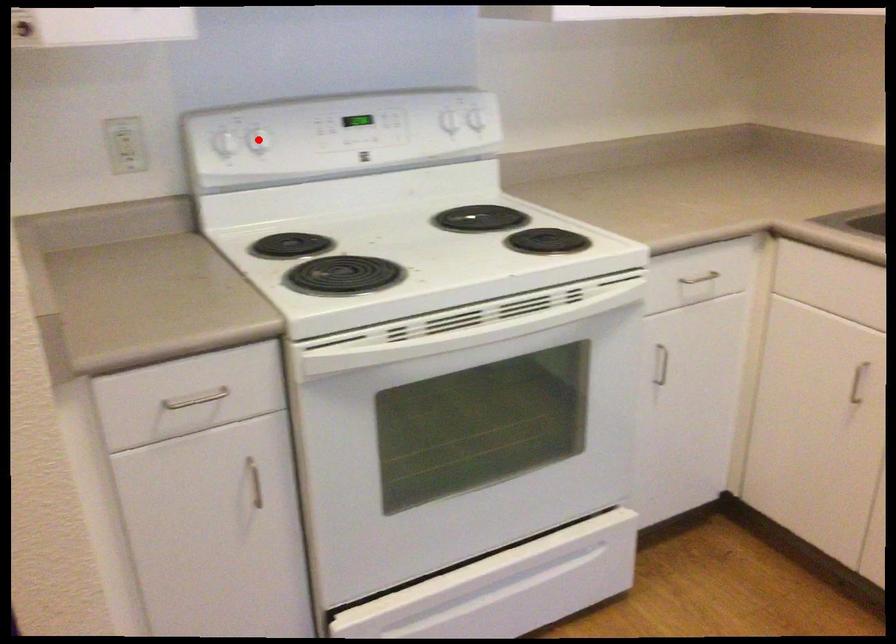
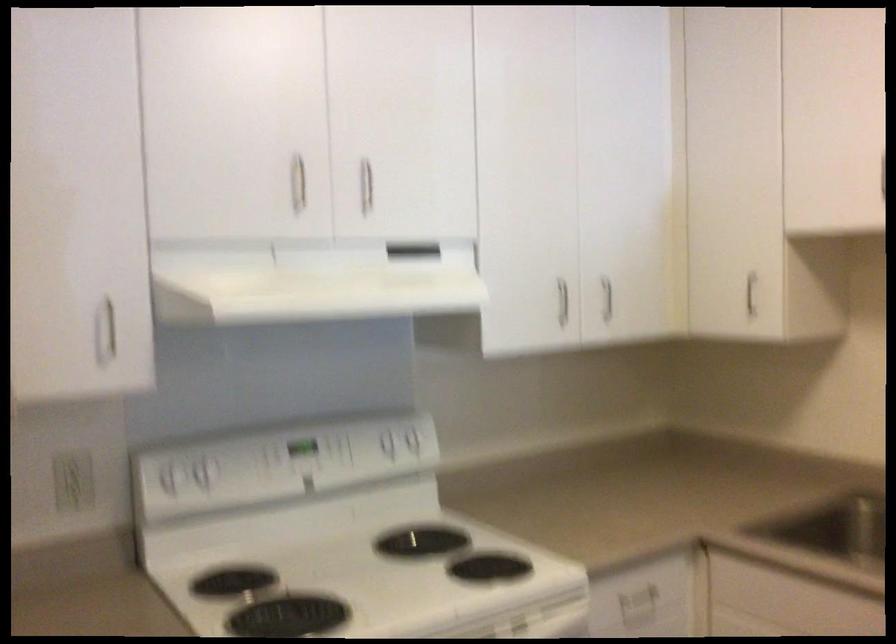
Find the pixel in the second image that matches the highlighted location in the first image.

(200, 474)